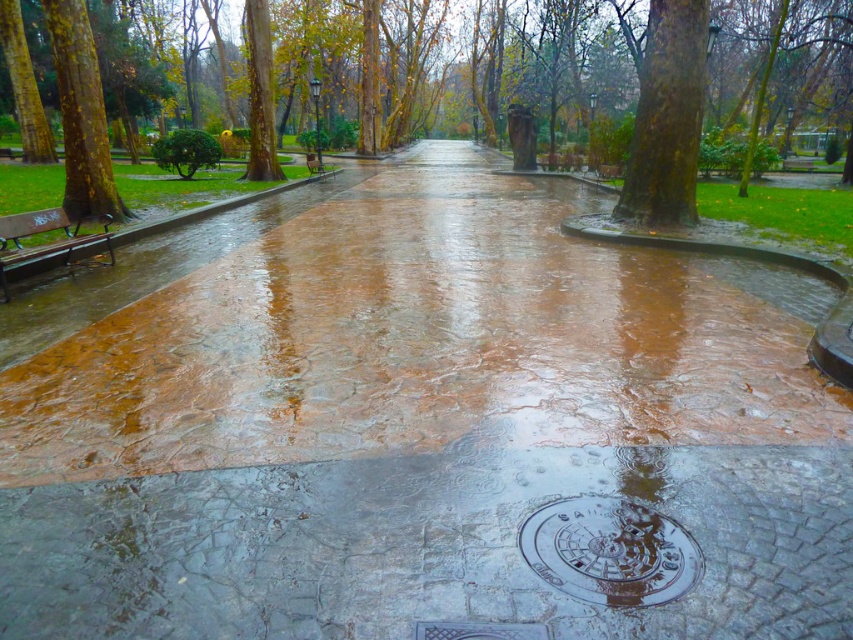
Question: Which point is closer to the camera taking this photo?

Choices:
 (A) click(x=62, y=248)
 (B) click(x=593, y=563)
 (C) click(x=672, y=64)

Answer: (B)

Question: Based on their relative distances, which object is nearer to the metallic silver manhole cover at center?

Choices:
 (A) yellow-green bark tree at left
 (B) green rough bark tree at upper right
 (C) wooden bench at left
 (D) brown textured tree at center

Answer: (C)

Question: Can you confirm if metallic silver manhole cover at center is positioned to the left of yellow-green bark tree at left?

Choices:
 (A) yes
 (B) no

Answer: (B)

Question: Where is metallic silver manhole cover at center located in relation to green rough bark tree at upper right in the image?

Choices:
 (A) left
 (B) right

Answer: (A)

Question: Where is brown textured tree at center located in relation to green rough bark tree at upper right in the image?

Choices:
 (A) right
 (B) left

Answer: (B)

Question: Which point is farther from the camera taking this photo?

Choices:
 (A) click(618, 602)
 (B) click(3, 266)

Answer: (B)